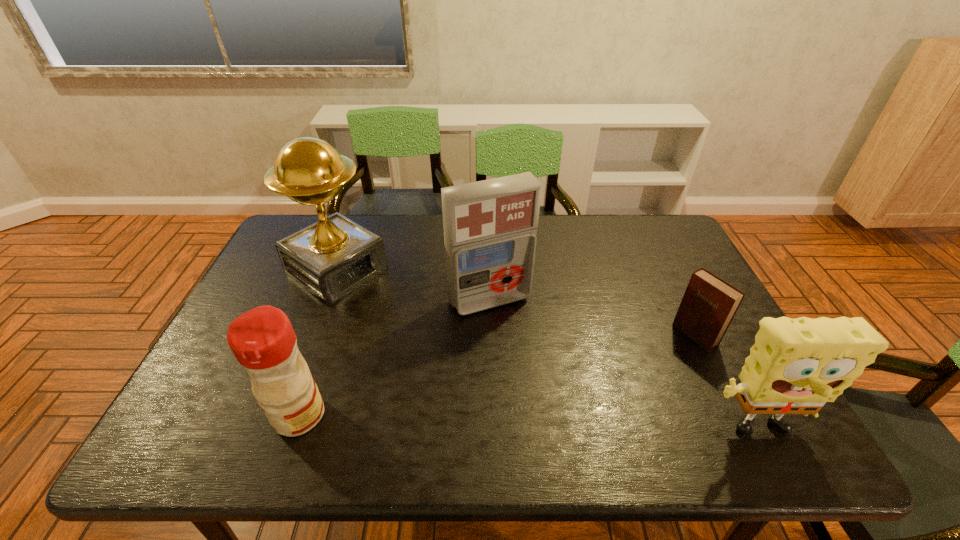
The height and width of the screenshot is (540, 960). Find the location of `condiment`. condiment is located at coordinates (262, 339).

Where is `sponge`? sponge is located at coordinates (796, 365).

Image resolution: width=960 pixels, height=540 pixels. What are the coordinates of `the third object from left to right` in the screenshot? It's located at (490, 226).

Locate an element on the screen. the fourth shortest object is located at coordinates tap(490, 226).

In order to click on the shortest object in this screenshot , I will do `click(709, 304)`.

Find the location of a particular element. The width and height of the screenshot is (960, 540). award is located at coordinates (331, 258).

Image resolution: width=960 pixels, height=540 pixels. I want to click on vacant region located on the back of the condiment, so click(324, 343).

At what (x,y) coordinates should I click in order to perform the action: click on blank space located 0.260m on the front-facing side of the third object from right to left. Please return your answer as a coordinate pair (x, y). Looking at the image, I should click on (550, 394).

Where is `vacant space located 0.260m on the front-facing side of the third object from right to left`? The image size is (960, 540). vacant space located 0.260m on the front-facing side of the third object from right to left is located at coordinates (550, 394).

Image resolution: width=960 pixels, height=540 pixels. Find the location of `vacant space located on the front-facing side of the third object from right to left`. vacant space located on the front-facing side of the third object from right to left is located at coordinates (542, 381).